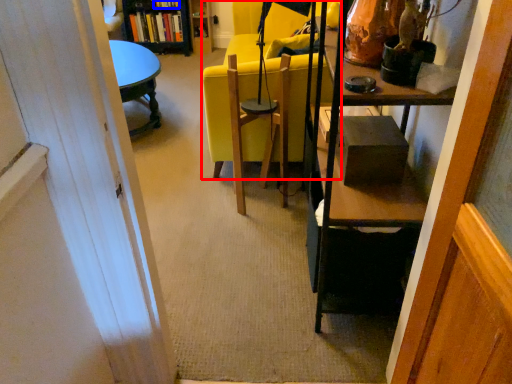
Question: Which object is further to the camera taking this photo, chair (highlighted by a red box) or book (highlighted by a blue box)?

Choices:
 (A) chair
 (B) book

Answer: (B)